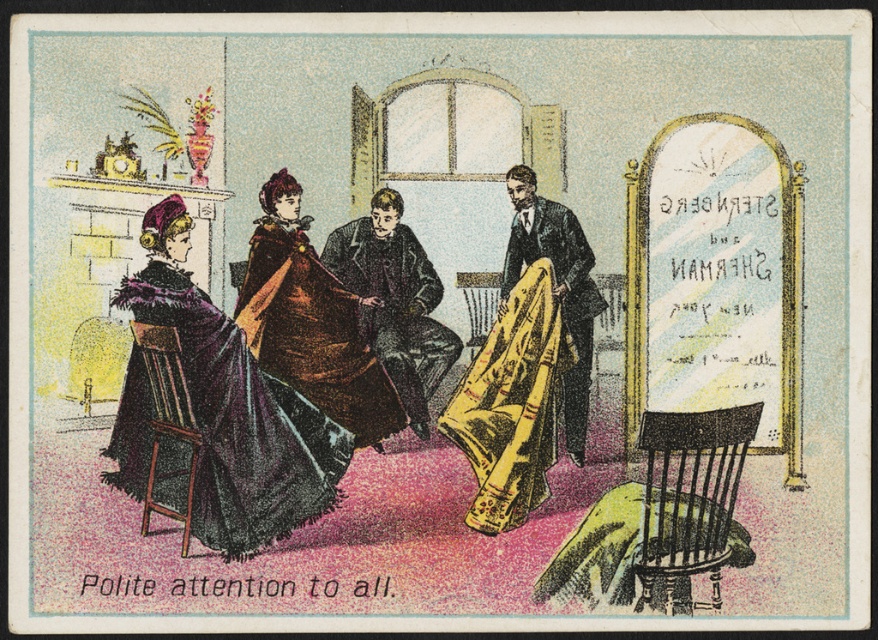
Can you confirm if velvet maroon dress at center is thinner than wooden chair at lower left?

Incorrect, velvet maroon dress at center's width is not less than wooden chair at lower left's.

Does velvet maroon dress at center appear over wooden chair at lower left?

Correct, velvet maroon dress at center is located above wooden chair at lower left.

Is point (300, 224) closer to camera compared to point (163, 372)?

No.

This screenshot has height=640, width=878. I want to click on velvet maroon dress at center, so click(310, 321).

Is velvet purple dress at left bigger than velvet maroon dress at center?

Yes, velvet purple dress at left is bigger than velvet maroon dress at center.

Between point (297, 509) and point (265, 204), which one is positioned in front?

Positioned in front is point (297, 509).

The width and height of the screenshot is (878, 640). What are the coordinates of `velvet purple dress at left` in the screenshot? It's located at (216, 413).

What do you see at coordinates (310, 321) in the screenshot? This screenshot has width=878, height=640. I see `velvet maroon dress at center` at bounding box center [310, 321].

Which is in front, point (318, 406) or point (372, 216)?

Point (318, 406)

Does point (277, 262) come farther from viewer compared to point (386, 257)?

No.

I want to click on velvet maroon dress at center, so click(310, 321).